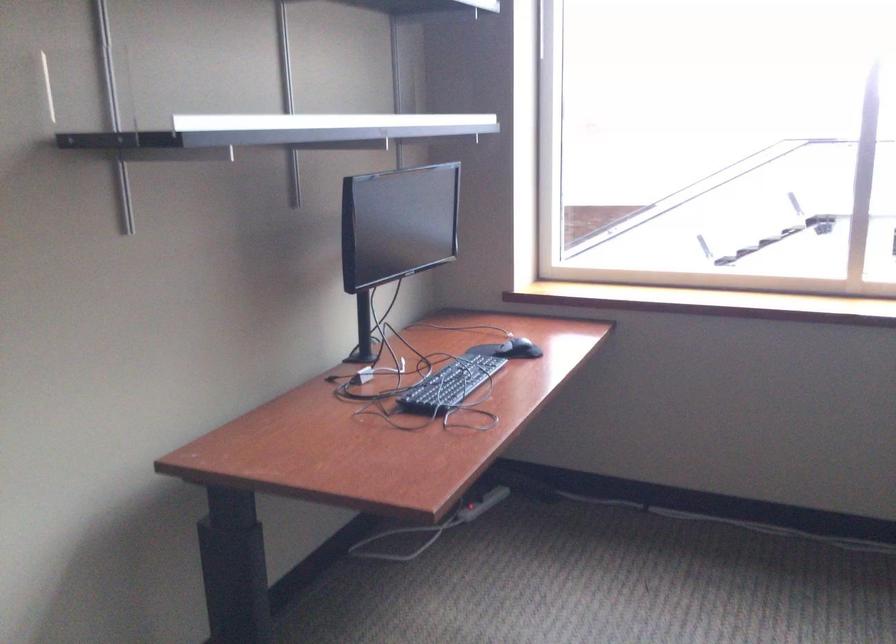
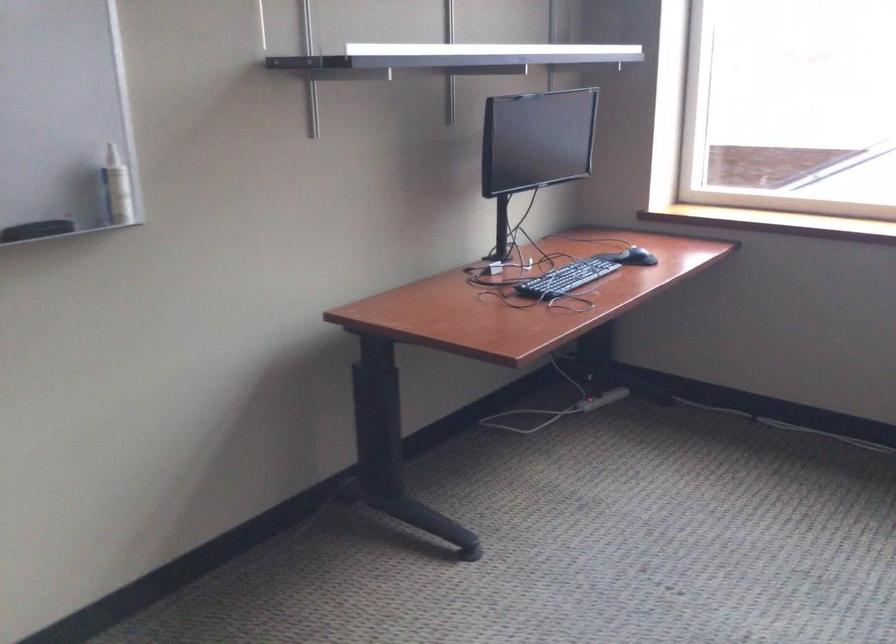
The point at (466,516) is marked in the first image. Where is the corresponding point in the second image?

(587, 404)